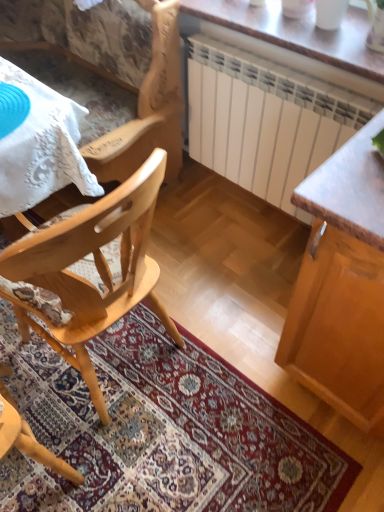
Question: Is natural wood chair at left, which is counted as the first chair, starting from the bottom, wider or thinner than carpeted mat at center?

Choices:
 (A) thin
 (B) wide

Answer: (A)

Question: From the image's perspective, is natural wood chair at left, which is counted as the first chair, starting from the bottom, located above or below carpeted mat at center?

Choices:
 (A) below
 (B) above

Answer: (B)

Question: Based on their relative distances, which object is farther from the wooden table at upper center?

Choices:
 (A) natural wood chair at left, which is the 2th chair from top to bottom
 (B) wooden cabinet at right
 (C) carpeted mat at center
 (D) wooden chair at left, the second chair positioned from the bottom
 (E) white lace tablecloth at upper left

Answer: (C)

Question: Estimate the real-world distances between objects in this image. Which object is farther from the wooden cabinet at right?

Choices:
 (A) wooden chair at left, which ranks as the 1th chair in top-to-bottom order
 (B) white lace tablecloth at upper left
 (C) carpeted mat at center
 (D) wooden table at upper center
 (E) natural wood chair at left, which is the 2th chair from top to bottom

Answer: (A)